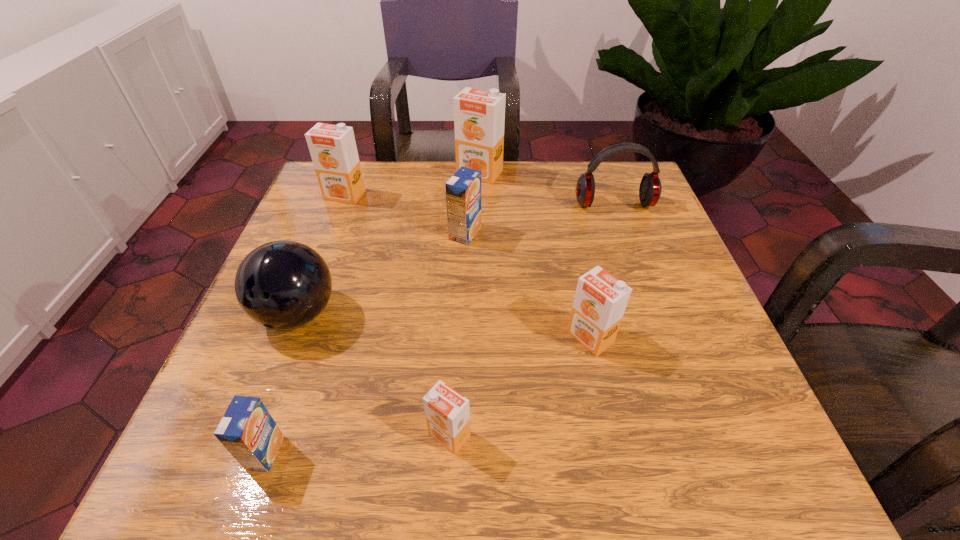
You are a GUI agent. You are given a task and a screenshot of the screen. Output one action in this format:
    pyautogui.click(x=<x>, y=<y>)
    Task: Click on the free space located on the right of the nearer blue orange_juice
    This screenshot has height=540, width=960.
    Given the screenshot: What is the action you would take?
    pyautogui.click(x=356, y=453)

Locate an element on the screen. This screenshot has height=540, width=960. earphone that is at the far edge is located at coordinates (650, 188).

I want to click on bowling ball positioned at the left edge, so click(x=283, y=284).

The height and width of the screenshot is (540, 960). In order to click on object at the right edge in this screenshot , I will do `click(650, 188)`.

At what (x,y) coordinates should I click in order to perform the action: click on object located in the far left corner section of the desktop. Please return your answer as a coordinate pair (x, y). This screenshot has height=540, width=960. Looking at the image, I should click on (333, 150).

Find the location of a particular element. This screenshot has width=960, height=540. object that is at the near left corner is located at coordinates (247, 430).

Identify the location of object positioned at the far right corner. (650, 188).

The image size is (960, 540). Find the location of `free space at the far edge of the desktop`. free space at the far edge of the desktop is located at coordinates (561, 195).

The image size is (960, 540). I want to click on free spot at the near edge of the desktop, so click(x=566, y=429).

In the image, there is a desktop. What are the coordinates of `vacant space at the left edge` in the screenshot? It's located at (308, 347).